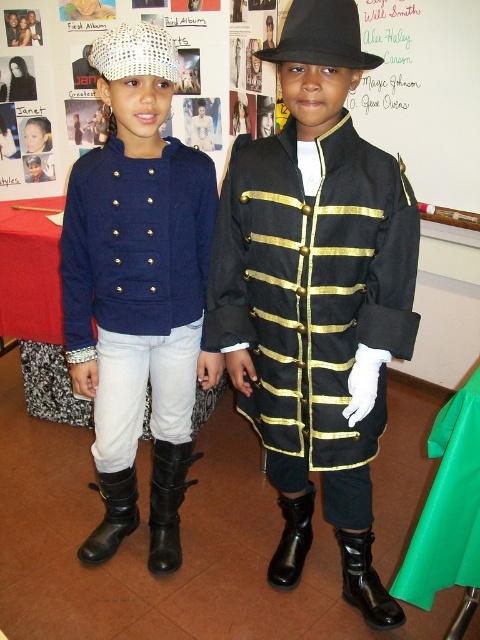
You are a costume designer preparing for a play. You need to decide which item to place first in the costume box. Since the black matte coat at center and the black rubber boot at lower center are both needed, which one requires more space due to its size?

The black matte coat at center requires more space because it is bigger than the black rubber boot at lower center.